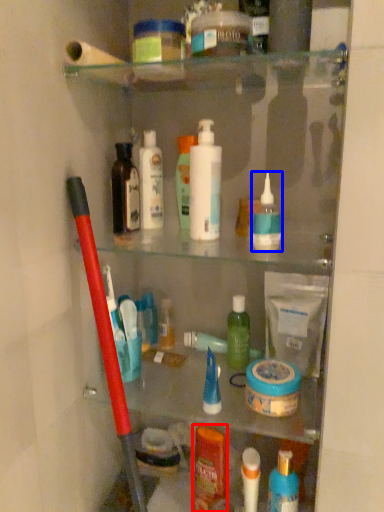
Question: Which point is closer to the camera, toiletry (highlighted by a red box) or toiletry (highlighted by a blue box)?

Choices:
 (A) toiletry
 (B) toiletry

Answer: (B)